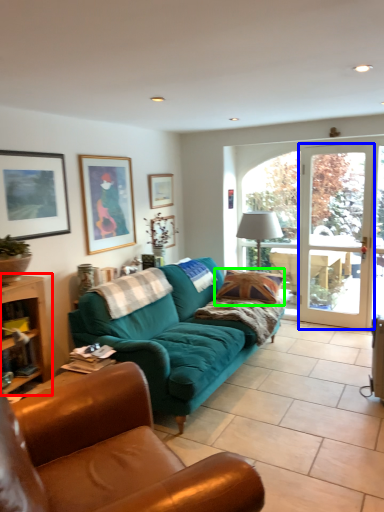
Question: Based on their relative distances, which object is farther from table (highlighted by a red box)? Choose from screen door (highlighted by a blue box) and pillow (highlighted by a green box).

Choices:
 (A) screen door
 (B) pillow

Answer: (A)